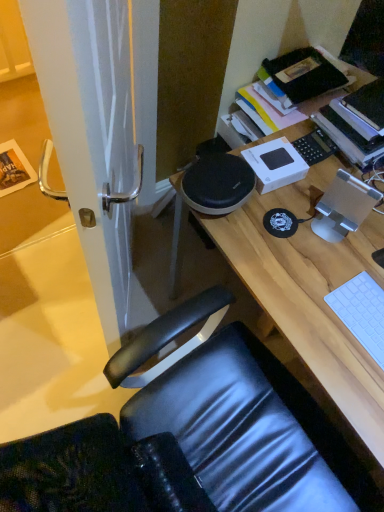
The height and width of the screenshot is (512, 384). Find the location of `vacant space to the left of white matte keyboard at lower right`. vacant space to the left of white matte keyboard at lower right is located at coordinates (310, 314).